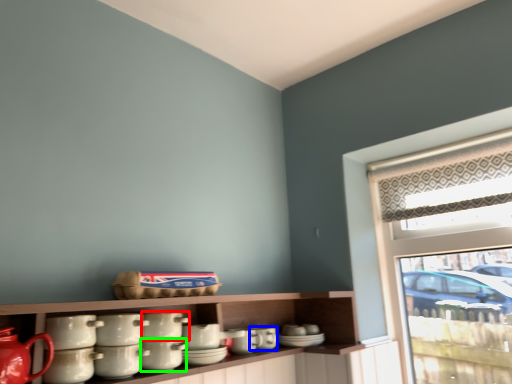
Question: Based on their relative distances, which object is farther from tableware (highlighted by a red box)? Choose from tableware (highlighted by a blue box) and tableware (highlighted by a green box).

Choices:
 (A) tableware
 (B) tableware

Answer: (A)